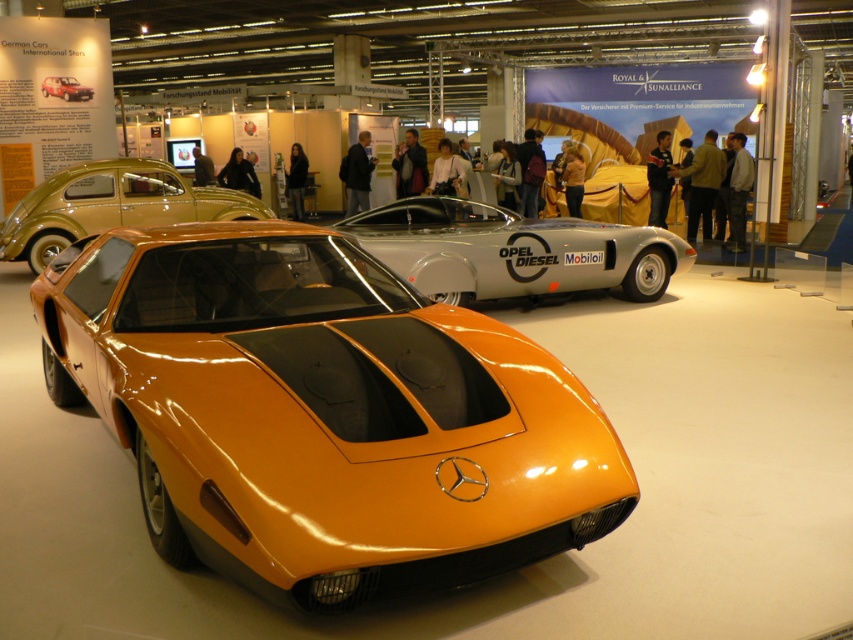
You are a photographer setting up a shoot in the car exhibition. You need to position a light source above the silver metallic sports car at center and the orange glossy car at center. Which car requires the light to be placed higher to avoid shadows?

The orange glossy car at center requires the light to be placed higher because it is taller than the silver metallic sports car at center.

You are standing at the entrance of the car exhibition and see two points marked in the image. Which point, point (x=563, y=474) or point (x=53, y=84), is closer to you?

Point (x=563, y=474) is in front of point (x=53, y=84), so it is closer to you.